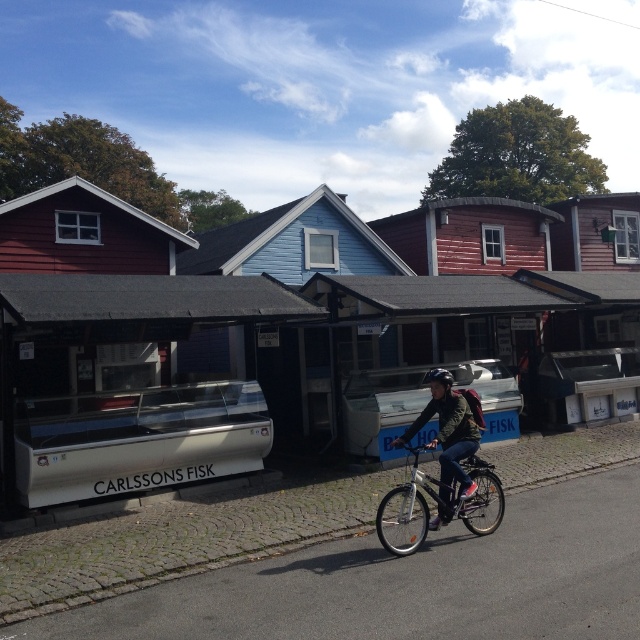
Can you confirm if silver metallic bicycle at center is thinner than dark green jacket at center?

No.

Is point (442, 516) positioned in front of point (460, 403)?

Yes, point (442, 516) is in front of point (460, 403).

Is point (404, 496) closer to camera compared to point (451, 376)?

That is True.

The image size is (640, 640). Find the location of `silver metallic bicycle at center`. silver metallic bicycle at center is located at coordinates (438, 504).

Who is more forward, (x=96, y=417) or (x=440, y=481)?

Point (x=440, y=481) is in front.

Which is below, metallic glass display case at left or dark green jacket at center?

metallic glass display case at left

Locate an element on the screen. Image resolution: width=640 pixels, height=640 pixels. metallic glass display case at left is located at coordinates (138, 440).

Is metallic glass display case at left taller than silver metallic bicycle at center?

Yes.

At what (x,y) coordinates should I click in order to perform the action: click on metallic glass display case at left. Please return your answer as a coordinate pair (x, y). Looking at the image, I should click on (138, 440).

This screenshot has width=640, height=640. In order to click on metallic glass display case at left in this screenshot , I will do `click(138, 440)`.